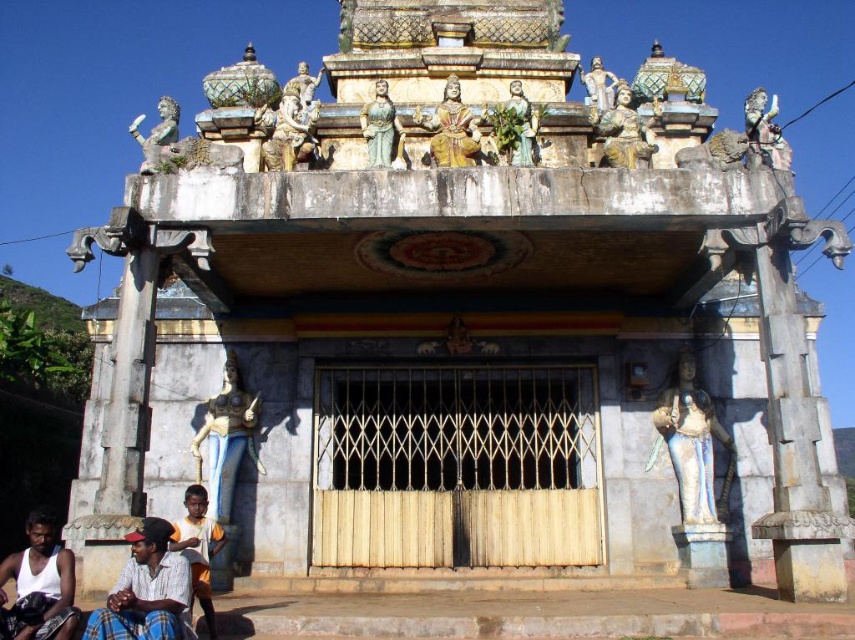
You are standing in front of a traditional temple with ornate multi tiered roofs and religious statues. You notice a point marked at coordinates (226, 440). Based on the temple layout, can you determine which object this point is located on?

The point at coordinates (226, 440) is on the blue stone statue at lower left.

You are standing at the entrance of the temple and notice a point marked at coordinates (39,586). Based on the temple scene described, what object is located at this coordinate?

The point at coordinates (39,586) corresponds to the white cotton shirt at lower left.

You are standing in front of the temple entrance and see the point marked at coordinates [226,440]. What object is located at that point?

The point at coordinates [226,440] indicates the blue stone statue at lower left.